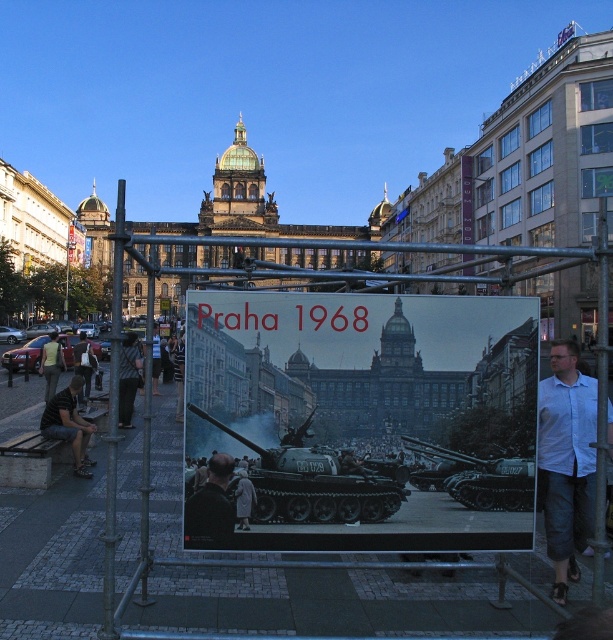
You are standing in the urban scene depicted in the image. There are two points marked in the image, one at coordinates point (397, 314) and the other at point (85, 452). Which of these points is nearer to you?

Point (397, 314) is closer to the viewer than point (85, 452).